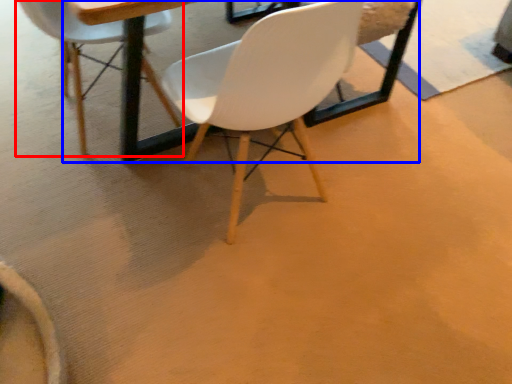
Question: Which point is closer to the camera, chair (highlighted by a red box) or round table (highlighted by a blue box)?

Choices:
 (A) chair
 (B) round table

Answer: (B)